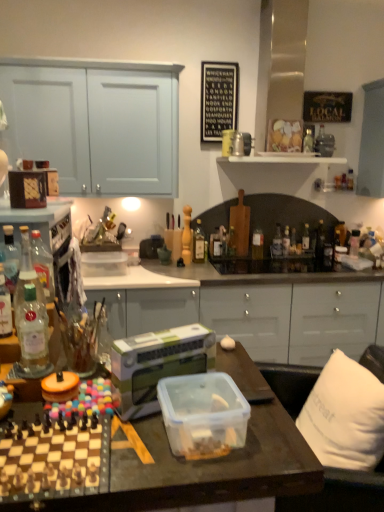
Question: Is translucent glass bottle at center, which ranks as the 6th bottle in right-to-left order, taller than orange plastic lid at center, the first appliance in the left-to-right sequence?

Choices:
 (A) no
 (B) yes

Answer: (B)

Question: Is translucent glass bottle at center, positioned as the 5th bottle in back-to-front order, to the right of orange plastic lid at center, marked as the 2th appliance in a right-to-left arrangement, from the viewer's perspective?

Choices:
 (A) no
 (B) yes

Answer: (B)

Question: Does translucent glass bottle at center, arranged as the 9th bottle when viewed from the front, have a smaller size compared to orange plastic lid at center, marked as the 2th appliance in a right-to-left arrangement?

Choices:
 (A) yes
 (B) no

Answer: (B)

Question: From a real-world perspective, is translucent glass bottle at center, which ranks as the 6th bottle in right-to-left order, positioned over orange plastic lid at center, the first appliance in the left-to-right sequence, based on gravity?

Choices:
 (A) no
 (B) yes

Answer: (B)

Question: Is orange plastic lid at center, the first appliance in the left-to-right sequence, at the back of translucent glass bottle at center, positioned as the 5th bottle in back-to-front order?

Choices:
 (A) no
 (B) yes

Answer: (A)

Question: Considering the positions of translucent glass bottle at center, arranged as the 9th bottle when viewed from the front, and translucent glass bottle at center, placed as the 6th bottle when sorted from front to back, in the image, is translucent glass bottle at center, arranged as the 9th bottle when viewed from the front, bigger or smaller than translucent glass bottle at center, placed as the 6th bottle when sorted from front to back,?

Choices:
 (A) small
 (B) big

Answer: (B)

Question: Is translucent glass bottle at center, arranged as the 9th bottle when viewed from the front, wider or thinner than translucent glass bottle at center, placed as the eighth bottle when sorted from back to front?

Choices:
 (A) thin
 (B) wide

Answer: (A)

Question: From the image's perspective, is translucent glass bottle at center, positioned as the 8th bottle in left-to-right order, located above or below translucent glass bottle at center, placed as the eighth bottle when sorted from back to front?

Choices:
 (A) below
 (B) above

Answer: (B)

Question: Visually, is translucent glass bottle at center, which ranks as the 6th bottle in right-to-left order, positioned to the left or to the right of translucent glass bottle at center, which is counted as the ninth bottle, starting from the right?

Choices:
 (A) right
 (B) left

Answer: (A)

Question: In terms of size, does white fabric pillow at right appear bigger or smaller than translucent glass bottle at center, acting as the eighth bottle starting from the right?

Choices:
 (A) big
 (B) small

Answer: (A)

Question: Is point (370, 413) closer or farther from the camera than point (231, 248)?

Choices:
 (A) closer
 (B) farther

Answer: (A)

Question: Considering their positions, is white fabric pillow at right located in front of or behind translucent glass bottle at center, acting as the eighth bottle starting from the right?

Choices:
 (A) behind
 (B) front

Answer: (B)

Question: Is white fabric pillow at right taller or shorter than translucent glass bottle at center, acting as the eighth bottle starting from the right?

Choices:
 (A) short
 (B) tall

Answer: (B)

Question: Based on their positions, is clear glass bottle at right, placed as the 12th bottle when sorted from left to right, located to the left or right of translucent glass bottle at center, arranged as the 9th bottle when viewed from the front?

Choices:
 (A) left
 (B) right

Answer: (B)

Question: Is clear glass bottle at right, the 1th bottle when ordered from back to front, wider or thinner than translucent glass bottle at center, which ranks as the 6th bottle in right-to-left order?

Choices:
 (A) thin
 (B) wide

Answer: (A)